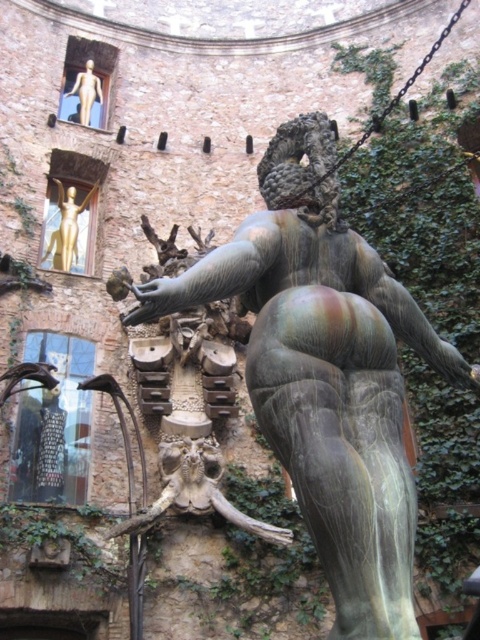
Looking at this image, you are an art curator examining the sculpture installation. You notice two statues labeled as gold metallic statue at upper left and matte gold statue at upper left. Based on their positions, which one is positioned to the right?

The gold metallic statue at upper left is positioned to the right of the matte gold statue at upper left.